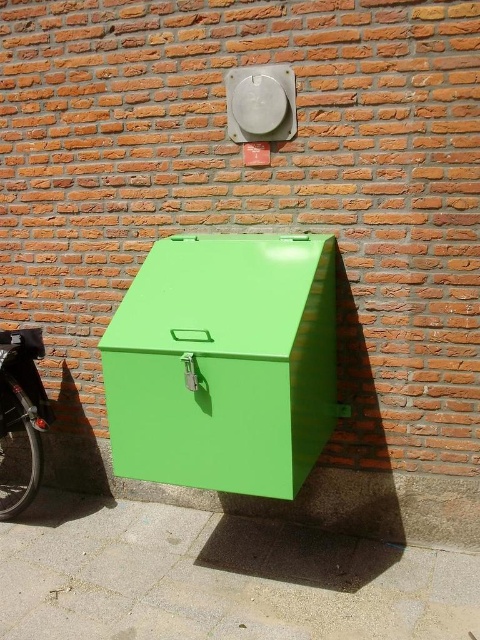
Question: Can you confirm if green metallic box at center is positioned to the left of shiny black bicycle at lower left?

Choices:
 (A) yes
 (B) no

Answer: (B)

Question: Is green metallic box at center positioned in front of shiny black bicycle at lower left?

Choices:
 (A) yes
 (B) no

Answer: (A)

Question: Estimate the real-world distances between objects in this image. Which object is closer to the shiny black bicycle at lower left?

Choices:
 (A) green metallic box at center
 (B) green matte pavement at lower center

Answer: (B)

Question: In this image, where is green metallic box at center located relative to shiny black bicycle at lower left?

Choices:
 (A) left
 (B) right

Answer: (B)

Question: Which object is farther from the camera taking this photo?

Choices:
 (A) shiny black bicycle at lower left
 (B) green matte pavement at lower center

Answer: (A)

Question: Which point is closer to the camera?

Choices:
 (A) (101, 570)
 (B) (41, 348)

Answer: (A)